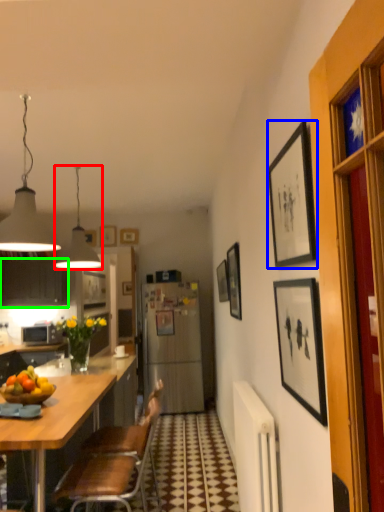
Question: Estimate the real-world distances between objects in this image. Which object is farther from lamp (highlighted by a red box), picture frame (highlighted by a blue box) or cabinetry (highlighted by a green box)?

Choices:
 (A) picture frame
 (B) cabinetry

Answer: (A)